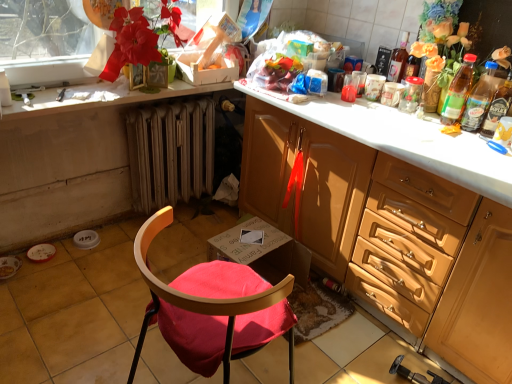
The width and height of the screenshot is (512, 384). In order to click on blank space to the left of translucent plastic bottle at right, the first bottle in the right-to-left sequence in this screenshot , I will do `click(443, 129)`.